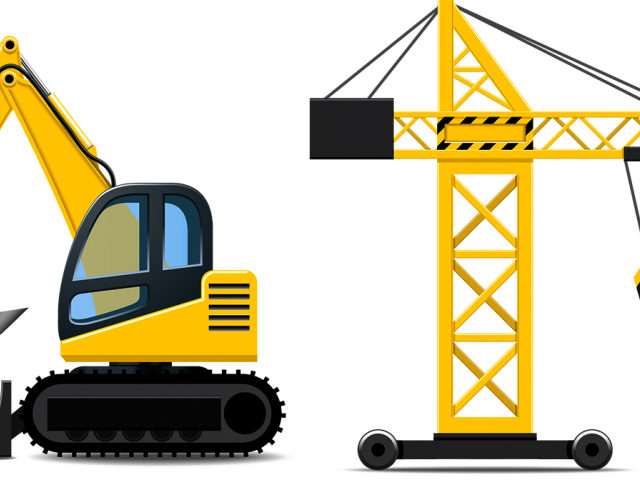
This screenshot has width=640, height=480. I want to click on black wire, so click(98, 161).